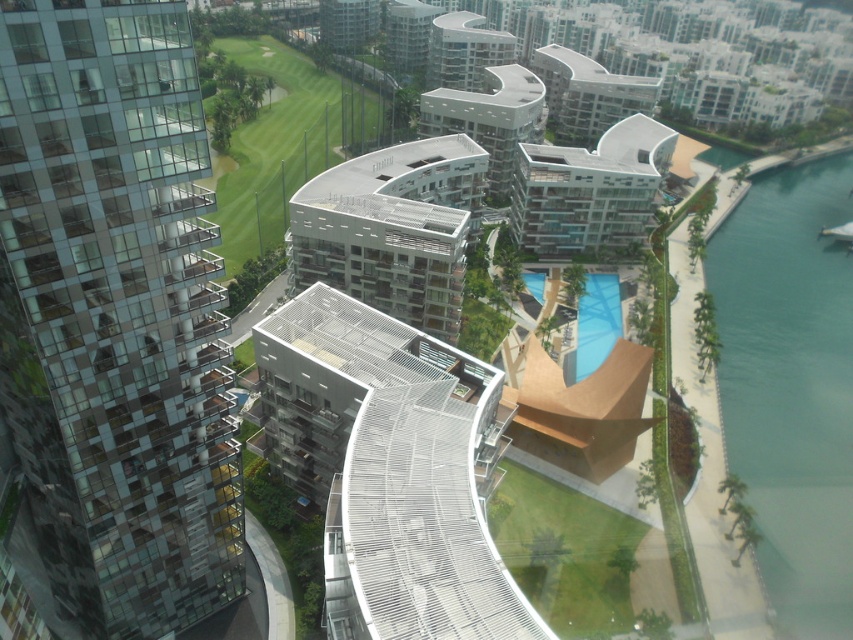
You are standing on the curved, metallic rooftop structure in the foreground of the urban landscape. You want to take a photo of the glassy reflective building at left. Based on your current position, will the building be fully visible in your camera frame? Please explain using the coordinates provided.

The glassy reflective building at left is located at coordinates approximately 0.492 on the x and 0.136 on the y axis. Since these coordinates place it within the central lower portion of the frame, it should be fully visible in your camera view from your current position on the curved metallic structure.

You are standing on the curved metallic walkway in the foreground. You want to take a photo of the glassy reflective building at left and the white glass building at center. Which building should you focus on first if you want to capture both in one frame without moving the camera?

You should focus on the glassy reflective building at left first because it is closer to you than the white glass building at center, so adjusting focus from near to far will help capture both in one frame.